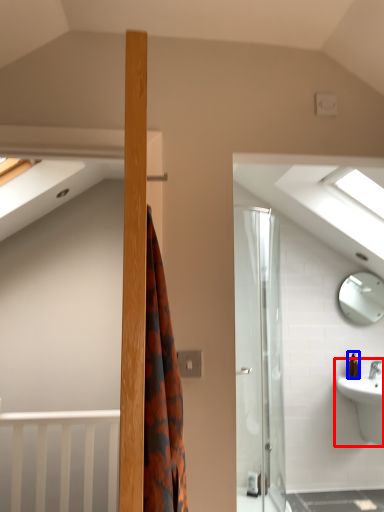
Question: Among these objects, which one is farthest to the camera, sink (highlighted by a red box) or toiletry (highlighted by a blue box)?

Choices:
 (A) sink
 (B) toiletry

Answer: (B)